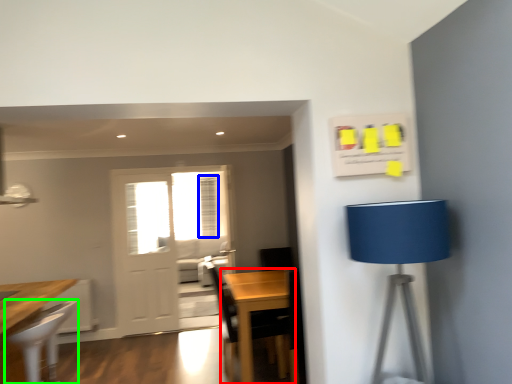
Question: Which object is positioned farthest from table (highlighted by a red box)? Select from curtain (highlighted by a blue box) and chair (highlighted by a green box).

Choices:
 (A) curtain
 (B) chair

Answer: (A)